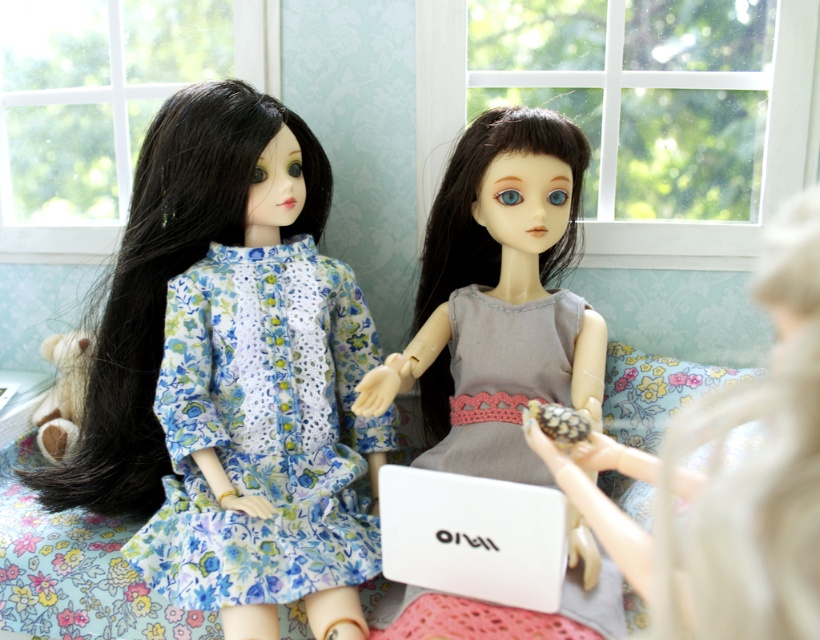
The image size is (820, 640). What do you see at coordinates (263, 429) in the screenshot?
I see `floral cotton dress at left` at bounding box center [263, 429].

Who is lower down, floral cotton dress at left or gray crochet dress at center?

gray crochet dress at center is lower down.

Who is more distant from viewer, (x=256, y=600) or (x=563, y=332)?

Positioned behind is point (x=563, y=332).

At what (x,y) coordinates should I click in order to perform the action: click on floral cotton dress at left. Please return your answer as a coordinate pair (x, y). Looking at the image, I should click on (263, 429).

Find the location of a particular element. matte gray dress at center is located at coordinates (730, 476).

Is matte gray dress at center thinner than gray crochet dress at center?

Incorrect, matte gray dress at center's width is not less than gray crochet dress at center's.

Who is more forward, (x=814, y=426) or (x=559, y=291)?

Point (x=814, y=426)

The width and height of the screenshot is (820, 640). What are the coordinates of `matte gray dress at center` in the screenshot? It's located at (730, 476).

Is floral fabric dress at left smaller than gray crochet dress at center?

No.

Can you confirm if floral fabric dress at left is bigger than gray crochet dress at center?

Correct, floral fabric dress at left is larger in size than gray crochet dress at center.

Locate an element on the screen. The width and height of the screenshot is (820, 640). floral fabric dress at left is located at coordinates (231, 376).

Locate an element on the screen. The width and height of the screenshot is (820, 640). floral fabric dress at left is located at coordinates click(x=231, y=376).